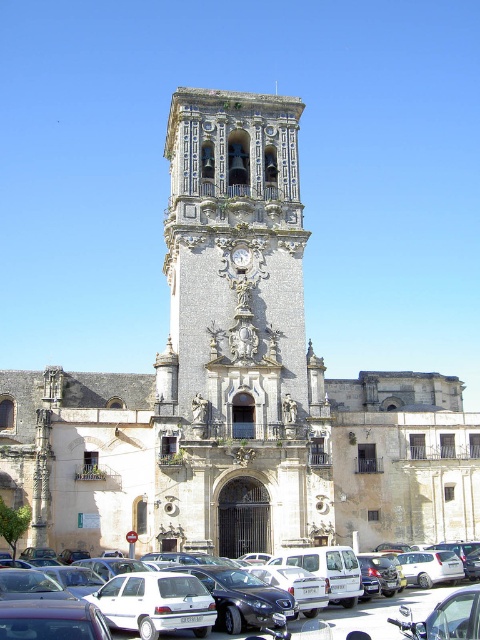
You are a tourist standing in front of the historic stone church. You see the white matte cars at lower center and the gold textured clock at center. Which object is positioned lower in the image?

The white matte cars at lower center is positioned below the gold textured clock at center, so it is lower in the image.

You are a tourist standing in front of the historic church. You see the white matte cars at lower center and the gold textured clock at center. Which object is positioned to the right of the other?

The white matte cars at lower center are to the right of the gold textured clock at center.